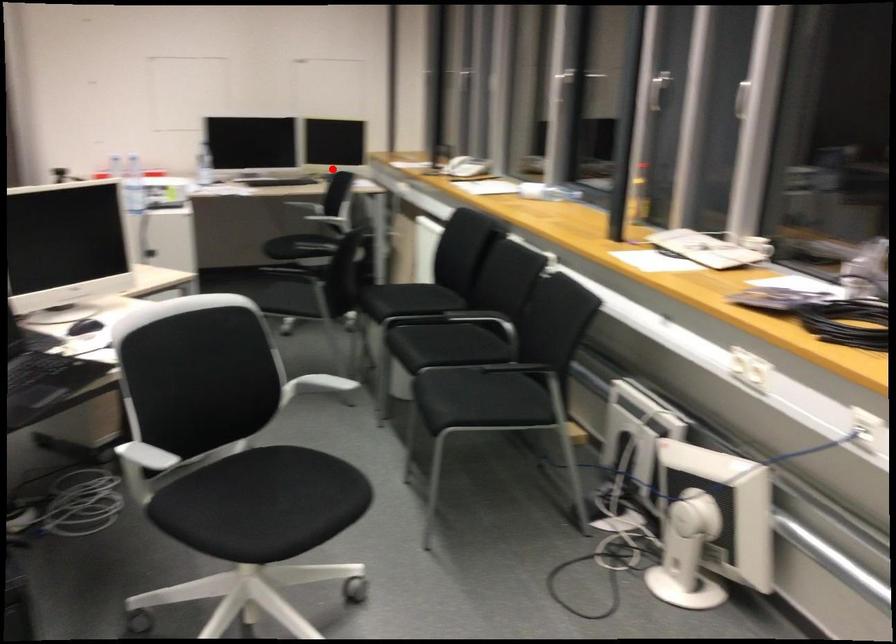
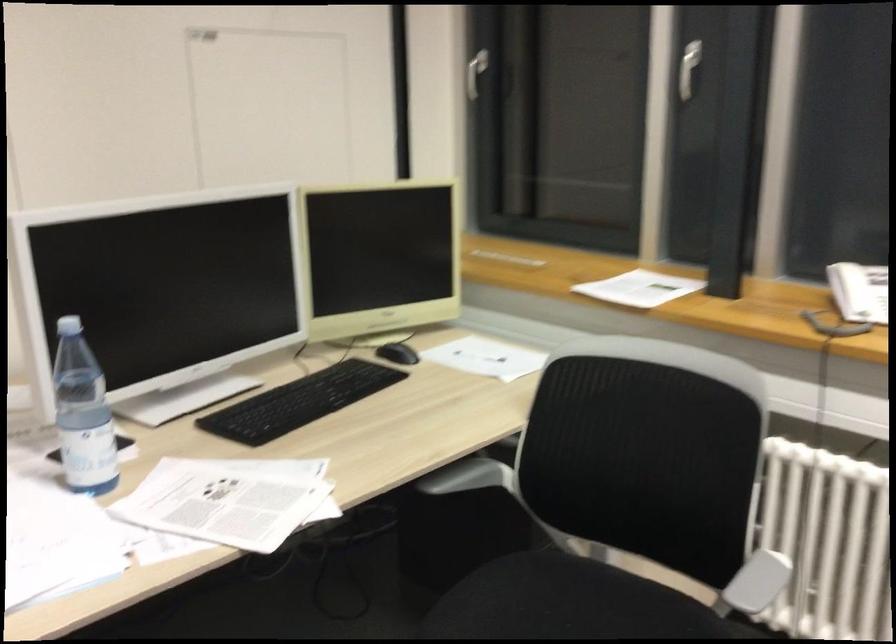
Question: A red point is marked in image1. In image2, is the corresponding 3D point closer to the camera or farther? Reply with the corresponding letter.

Choices:
 (A) The corresponding 3D point is closer.
 (B) The corresponding 3D point is farther.

Answer: (A)